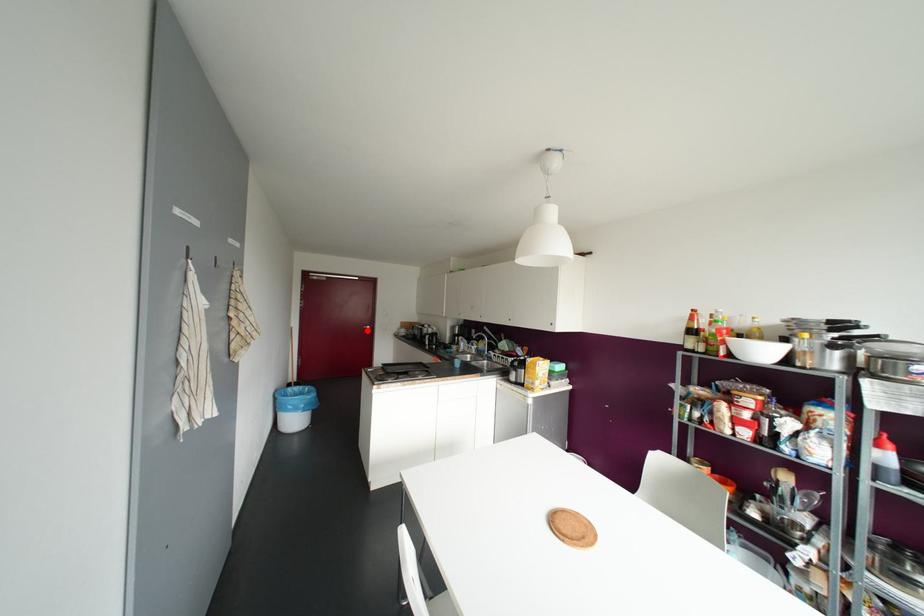
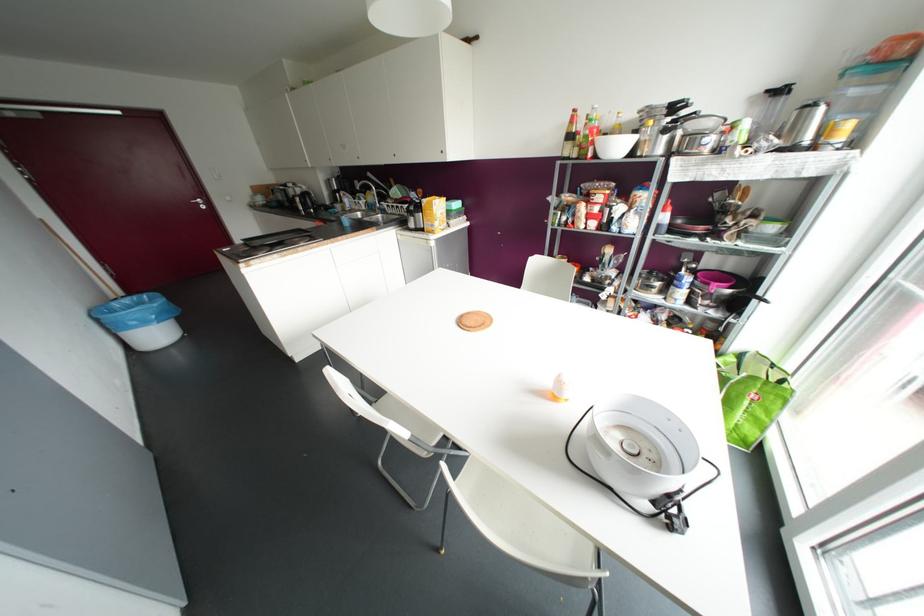
Question: A red point is marked in image1. In image2, is the corresponding 3D point closer to the camera or farther? Reply with the corresponding letter.

Choices:
 (A) The corresponding 3D point is closer.
 (B) The corresponding 3D point is farther.

Answer: (A)